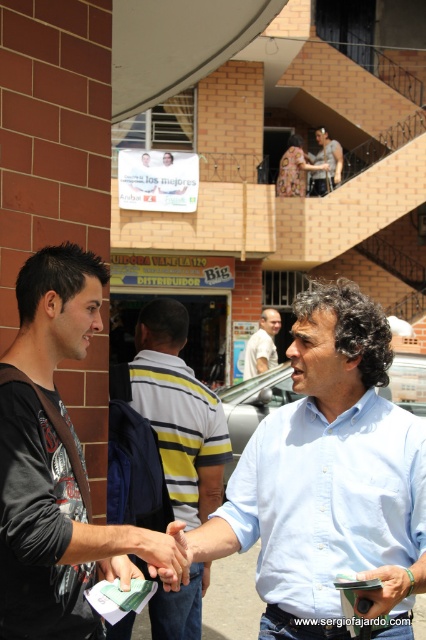
Between matte black hand at center and smooth leather wallet at lower right, which one has more height?

matte black hand at center

Does matte black hand at center have a lesser height compared to smooth leather wallet at lower right?

Incorrect, matte black hand at center's height does not fall short of smooth leather wallet at lower right's.

What are the coordinates of `matte black hand at center` in the screenshot? It's located at (164, 554).

Between black matte shirt at left and yellow striped shirt at center, which one is positioned lower?

yellow striped shirt at center is lower down.

Does point (54, 525) come closer to viewer compared to point (218, 472)?

Yes, point (54, 525) is closer to viewer.

What do you see at coordinates (52, 531) in the screenshot?
I see `black matte shirt at left` at bounding box center [52, 531].

I want to click on black matte shirt at left, so click(52, 531).

Can you confirm if light blue button-down shirt at center is positioned above smooth leather wallet at lower right?

Yes, light blue button-down shirt at center is above smooth leather wallet at lower right.

Is point (342, 484) more distant than point (357, 577)?

Yes, point (342, 484) is behind point (357, 577).

Where is `light blue button-down shirt at center`? The width and height of the screenshot is (426, 640). light blue button-down shirt at center is located at coordinates (328, 499).